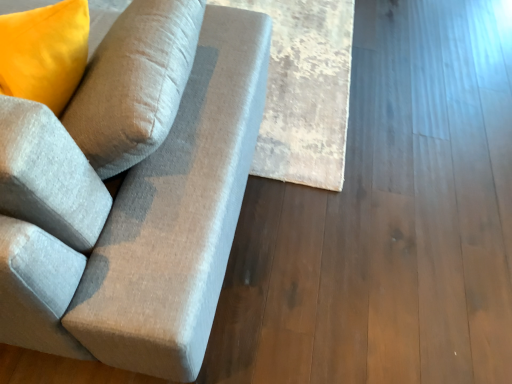
Question: Considering the positions of textured gray fabric couch at left and beige textured rug at center in the image, is textured gray fabric couch at left bigger or smaller than beige textured rug at center?

Choices:
 (A) big
 (B) small

Answer: (A)

Question: Is textured gray fabric couch at left taller or shorter than beige textured rug at center?

Choices:
 (A) tall
 (B) short

Answer: (A)

Question: From a real-world perspective, is textured gray fabric couch at left positioned above or below beige textured rug at center?

Choices:
 (A) below
 (B) above

Answer: (B)

Question: In terms of height, does beige textured rug at center look taller or shorter compared to textured gray fabric couch at left?

Choices:
 (A) short
 (B) tall

Answer: (A)

Question: Which is correct: beige textured rug at center is inside textured gray fabric couch at left, or outside of it?

Choices:
 (A) inside
 (B) outside

Answer: (B)

Question: Considering the positions of beige textured rug at center and textured gray fabric couch at left in the image, is beige textured rug at center wider or thinner than textured gray fabric couch at left?

Choices:
 (A) thin
 (B) wide

Answer: (A)

Question: From the image's perspective, is beige textured rug at center located above or below textured gray fabric couch at left?

Choices:
 (A) above
 (B) below

Answer: (A)